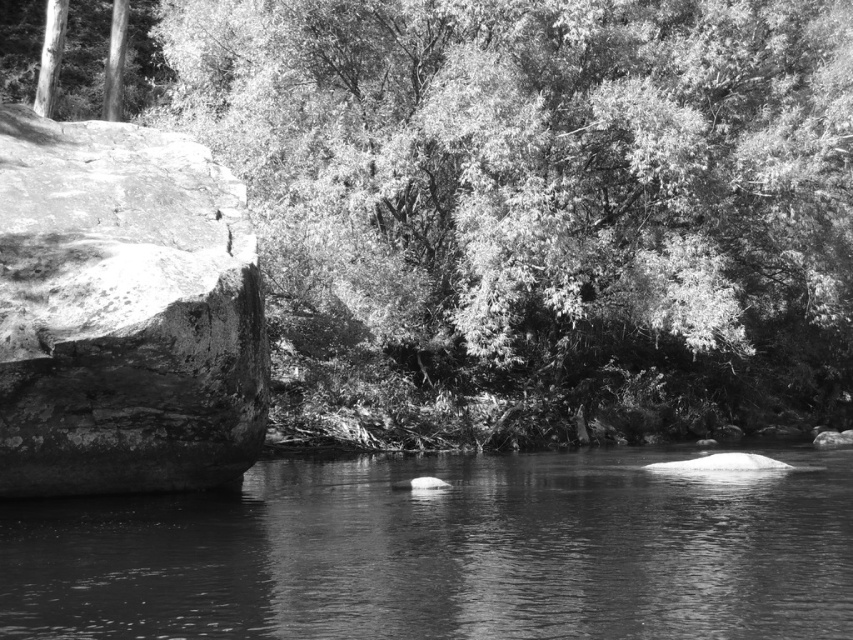
You are a photographer standing at the edge of the river. You want to capture the smooth water at center and the rough textured rock at left in your shot. Based on their positions, which object is closer to the photographer?

The rough textured rock at left is closer to the photographer because it is positioned above the smooth water at center, indicating it is in the foreground of the scene.

You are standing in the scene and want to place a small decorative item between the smooth green leaves at upper center and the rough textured rock at left. Where should you place it to ensure it is between them?

You should place the small decorative item to the right of the rough textured rock at left and to the left of the smooth green leaves at upper center, as the smooth green leaves at upper center is positioned on the right side of the rough textured rock at left.

Consider the image. You are an artist sketching this scene. You have to decide which object to draw first based on their sizes. Which one should you start with, the smooth green leaves at upper center or the rough textured rock at left?

The smooth green leaves at upper center is bigger than the rough textured rock at left, so you should start with the smooth green leaves at upper center since it is larger and might require more attention to detail first.